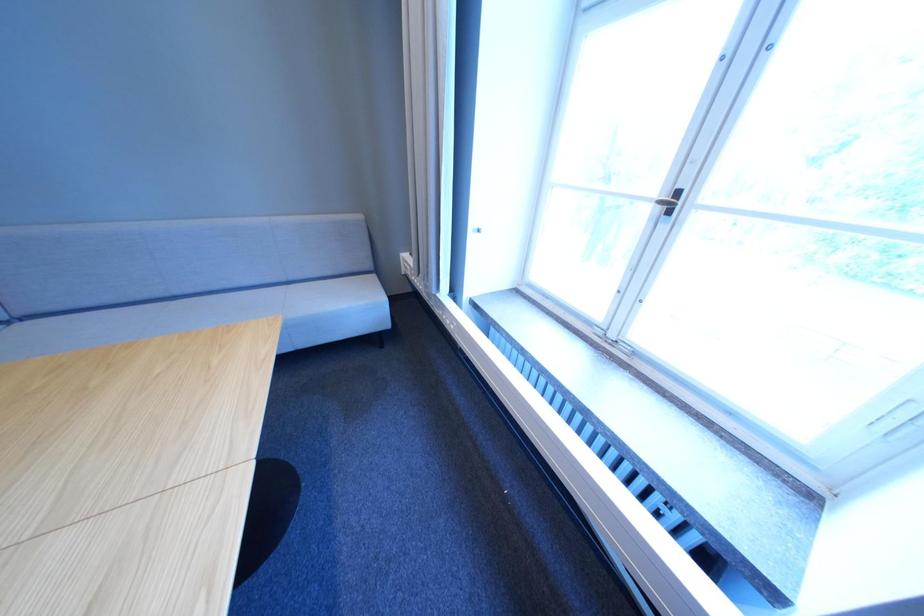
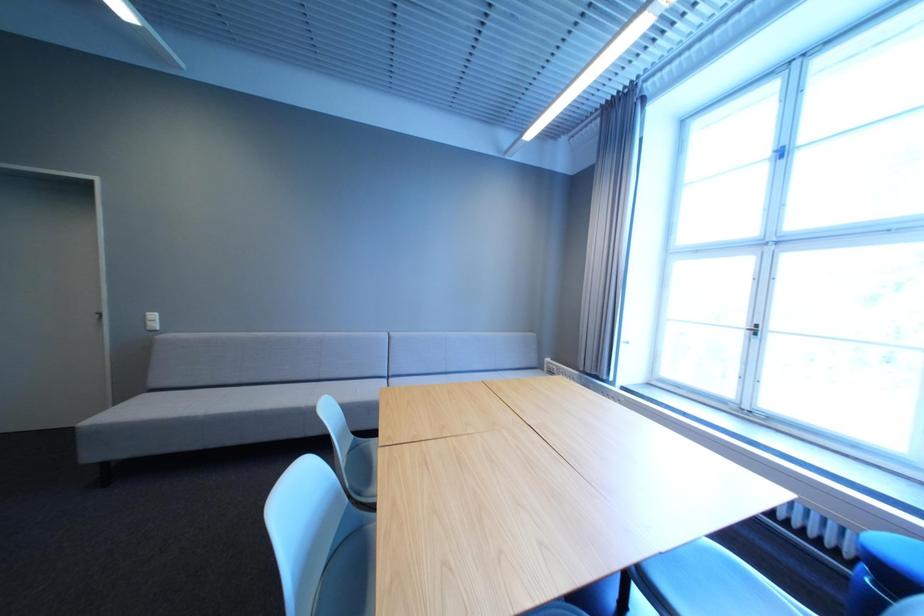
The images are taken continuously from a first-person perspective. In which direction are you moving?

The movement direction of the cameraman is left, backward.